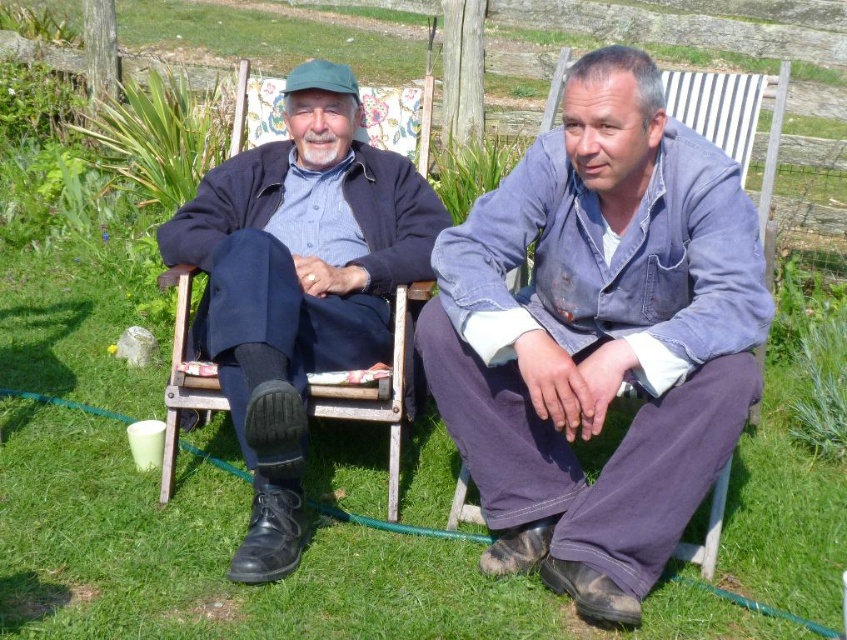
You are a tailor measuring jackets for alterations. You have two jackets in front of you, the denim jacket at center and the matte black jacket at left. Which jacket requires a wider sleeve alteration to match the other?

The matte black jacket at left requires a wider sleeve alteration because it has a greater width than the denim jacket at center.

You are a fashion designer observing two jackets in a garden scene. The denim jacket at center and the matte black jacket at left are part of the outfits. Which jacket is shorter in height?

The denim jacket at center has a lesser height compared to the matte black jacket at left, so the denim jacket at center is shorter in height.

What are the coordinates of the denim jacket at center in the image?

The denim jacket at center is located at coordinates point (599,337).